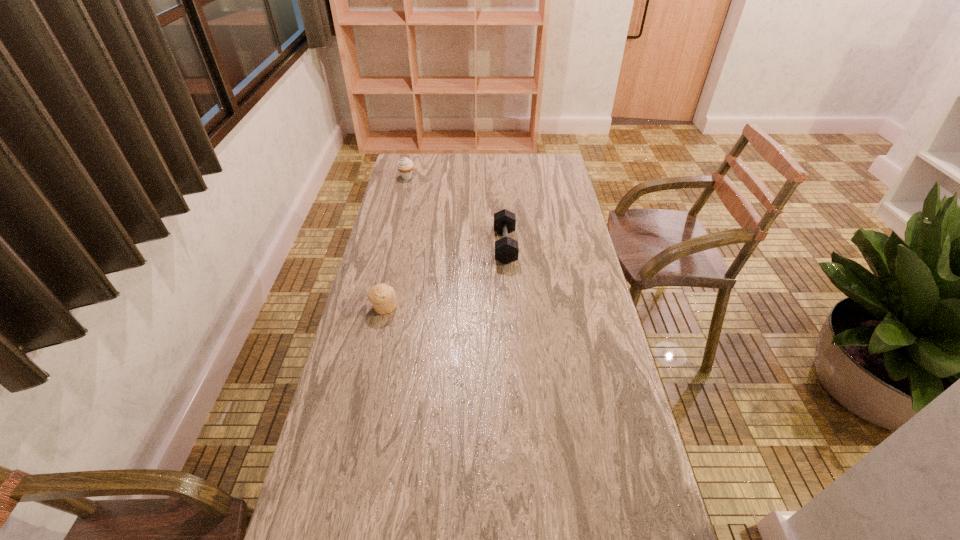
Image resolution: width=960 pixels, height=540 pixels. What are the coordinates of `object at the far left corner` in the screenshot? It's located at (405, 166).

In the image, there is a desktop. Identify the location of vacant space at the far edge. (447, 158).

Identify the location of free space at the left edge of the desktop. Image resolution: width=960 pixels, height=540 pixels. (346, 363).

You are a GUI agent. You are given a task and a screenshot of the screen. Output one action in this format:
    pyautogui.click(x=<x>, y=<y>)
    Task: Click on the free region at the right edge
    
    Given the screenshot: What is the action you would take?
    pyautogui.click(x=540, y=206)

The width and height of the screenshot is (960, 540). Find the location of `free space at the far left corner`. free space at the far left corner is located at coordinates (420, 172).

This screenshot has height=540, width=960. Find the location of `free space between the rightmost object and the nearest object`. free space between the rightmost object and the nearest object is located at coordinates (444, 276).

This screenshot has height=540, width=960. What are the coordinates of `vacant space that's between the rightmost object and the farther muffin` in the screenshot? It's located at (456, 212).

What are the coordinates of `vacant point located between the farther muffin and the dumbbell` in the screenshot? It's located at (456, 212).

Where is `free space between the taller muffin and the nearer muffin`? The width and height of the screenshot is (960, 540). free space between the taller muffin and the nearer muffin is located at coordinates (396, 242).

This screenshot has width=960, height=540. In order to click on vacant space that is in between the rightmost object and the nearer muffin in this screenshot , I will do `click(444, 276)`.